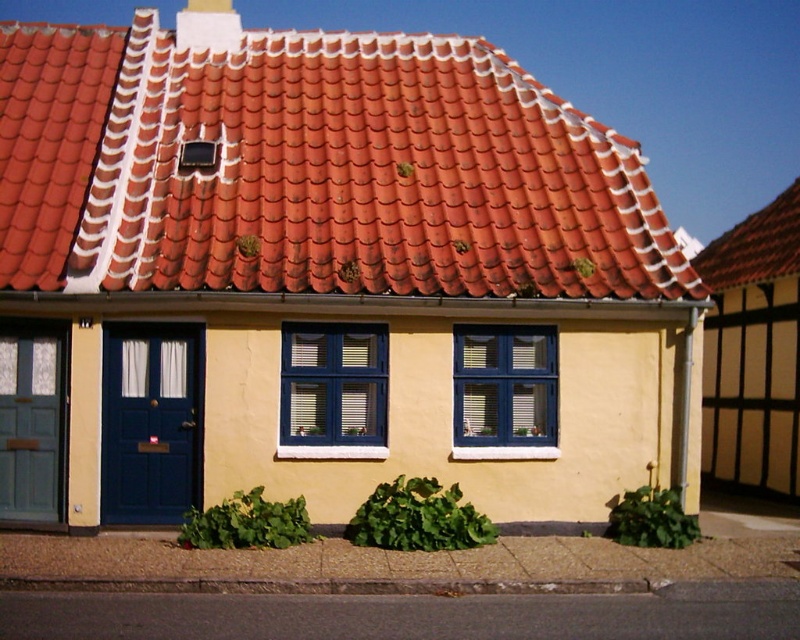
You are an architect designing a new house and want to incorporate the style of the traditional house in the image. Where exactly should you place the red clay tiles at upper center on your design blueprint to match the original house?

You should place the red clay tiles at upper center at point (314,170) on your design blueprint to match the original house.

You are a delivery person carrying a package that requires a 30 inch clearance to pass through a doorway. You arrive at the house and see the matte blue door at lower left and the teal wooden door at left. Can you fit through the space between these two doors?

The matte blue door at lower left is 31.13 inches away from the teal wooden door at left, so yes, the delivery person can fit through the space between the two doors since the clearance is sufficient for the 30 inch requirement.

Looking at this image, you are standing in front of the house and see both the matte blue door at lower left and the teal wooden door at left. Which door is positioned to the right when facing the house?

The matte blue door at lower left is to the right of the teal wooden door at left.